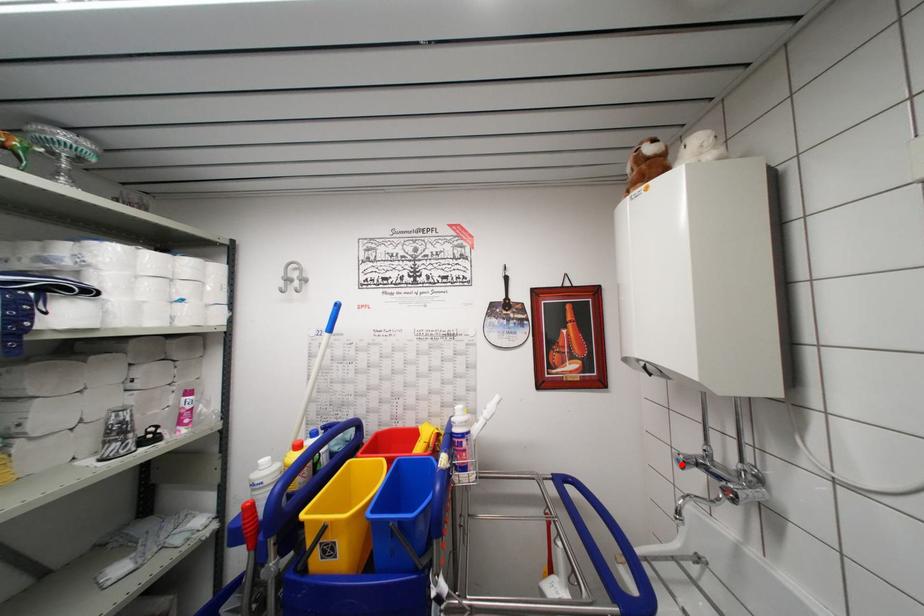
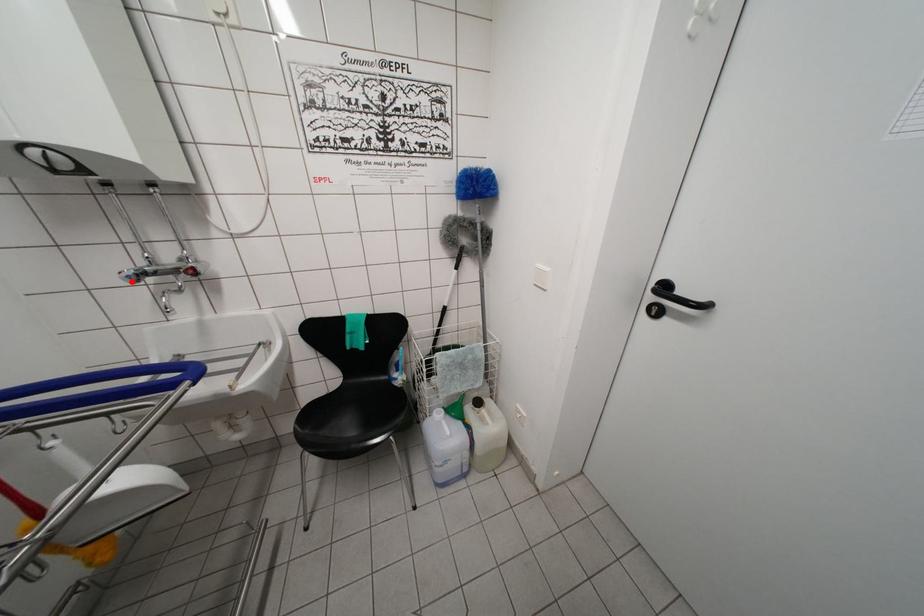
I am providing you with two images of the same scene from different viewpoints. A red point is marked on the first image and another point is marked on the second image. Is the marked point in image1 the same physical position as the marked point in image2?

Yes